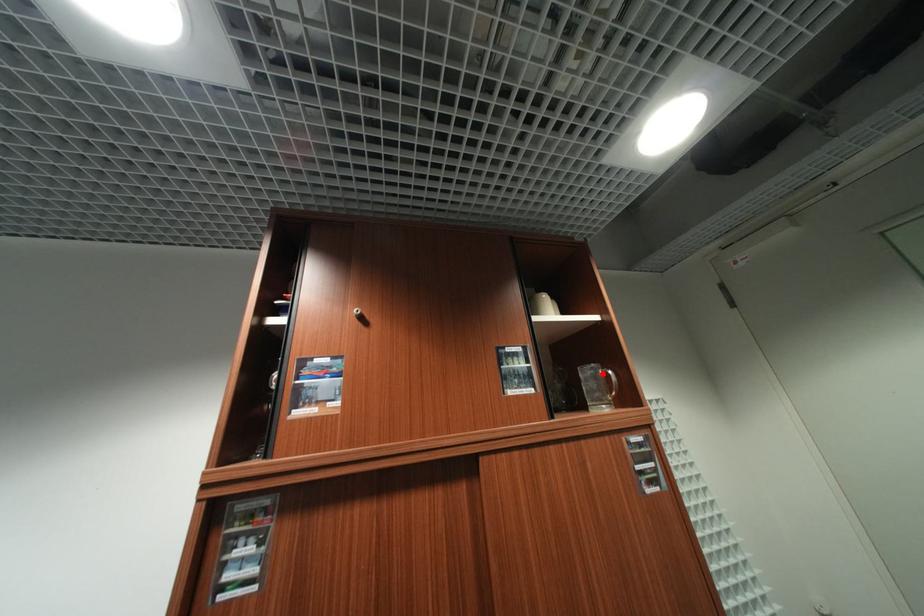
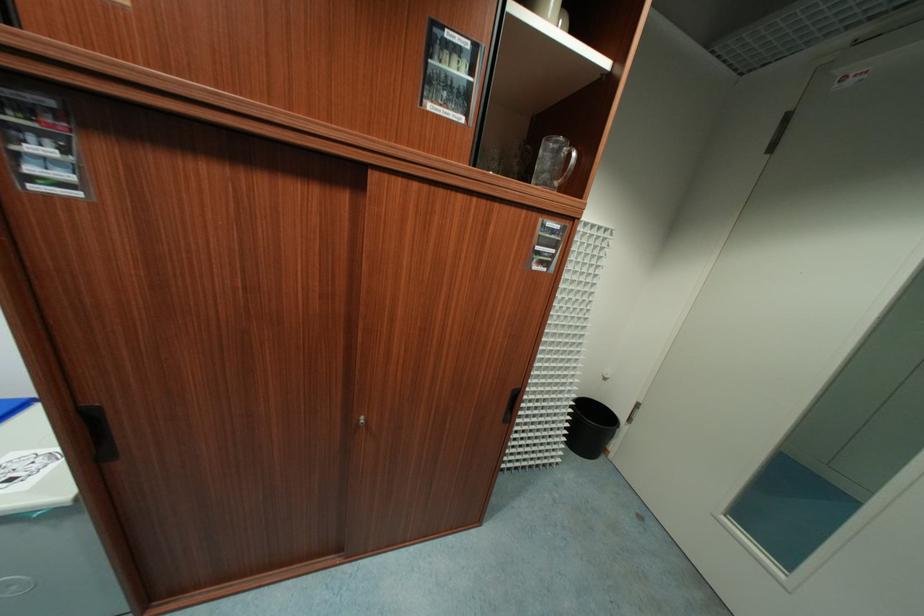
Question: I am providing you with two images of the same scene from different viewpoints. A red point is marked on the first image. At the location where the point appears in image 1, is it still visible in image 2?

Choices:
 (A) Yes
 (B) No

Answer: (A)